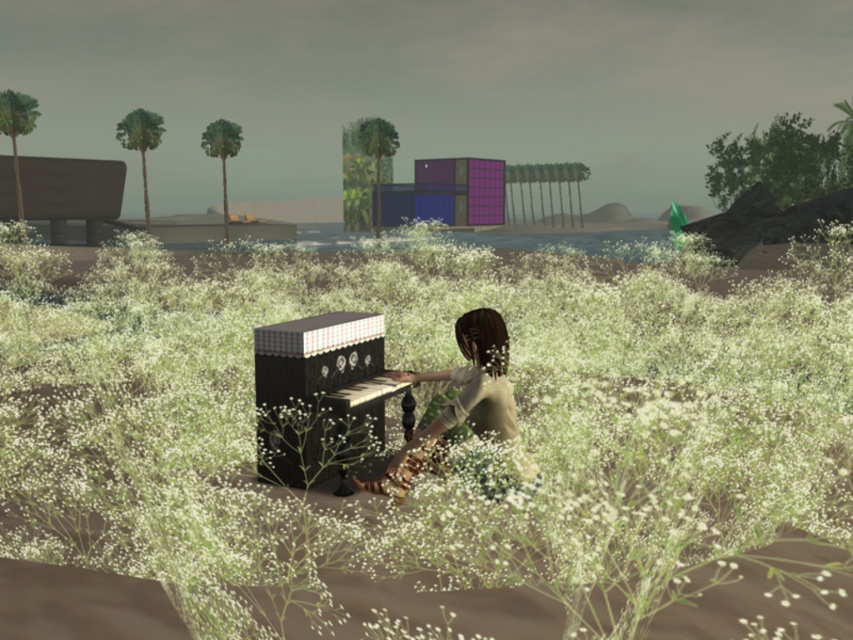
Question: Considering the relative positions of white fluffy grass at center and matte brown hair at center in the image provided, where is white fluffy grass at center located with respect to matte brown hair at center?

Choices:
 (A) above
 (B) below

Answer: (A)

Question: Which point appears farthest from the camera in this image?

Choices:
 (A) (202, 324)
 (B) (502, 352)

Answer: (A)

Question: Does white fluffy grass at center have a greater width compared to matte brown hair at center?

Choices:
 (A) yes
 (B) no

Answer: (A)

Question: Which of the following is the closest to the observer?

Choices:
 (A) matte brown hair at center
 (B) white fluffy grass at center

Answer: (B)

Question: Can you confirm if white fluffy grass at center is smaller than matte brown hair at center?

Choices:
 (A) no
 (B) yes

Answer: (A)

Question: Which object appears farthest from the camera in this image?

Choices:
 (A) matte brown hair at center
 (B) white fluffy grass at center

Answer: (A)